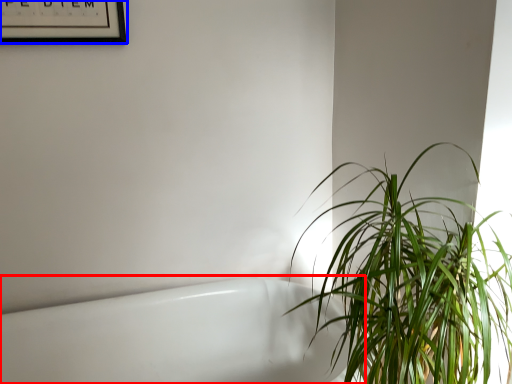
Question: Among these objects, which one is nearest to the camera, bath (highlighted by a red box) or picture frame (highlighted by a blue box)?

Choices:
 (A) bath
 (B) picture frame

Answer: (A)